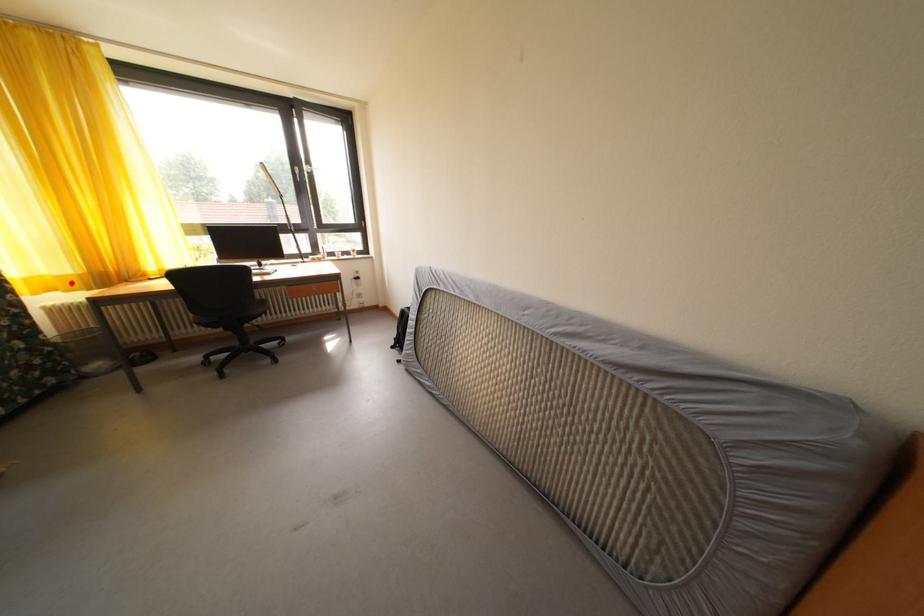
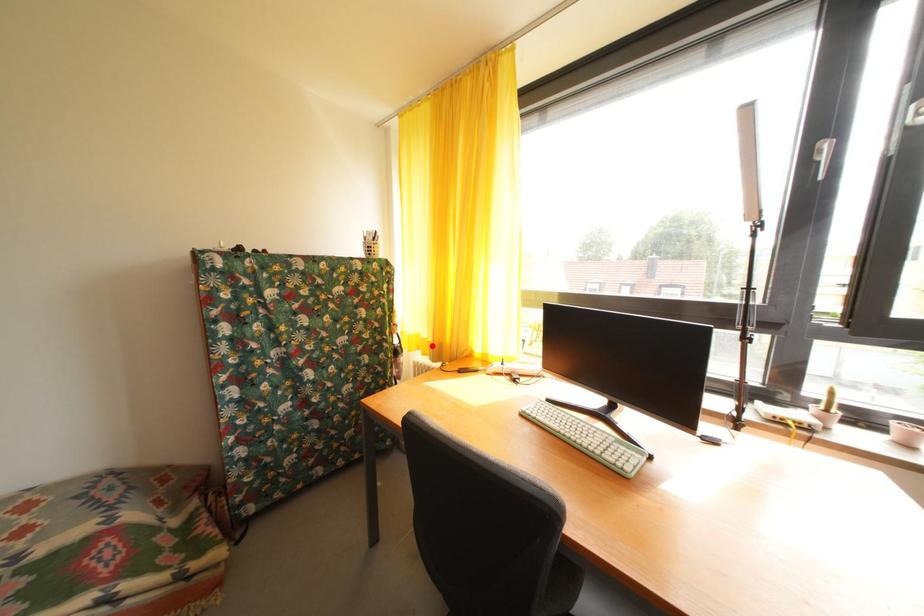
I am providing you with two images of the same scene from different viewpoints. A red point is marked on the first image and another point is marked on the second image. Is the marked point in image1 the same physical position as the marked point in image2?

Yes